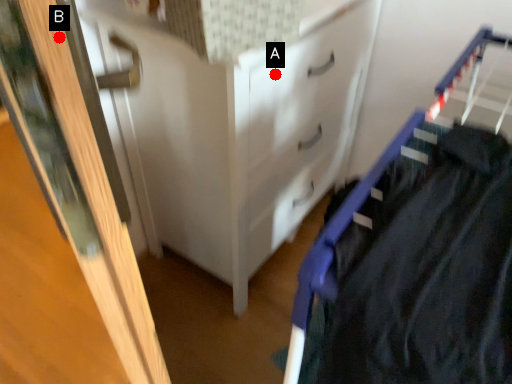
Question: Two points are circled on the image, labeled by A and B beside each circle. Which point appears closest to the camera in this image?

Choices:
 (A) A is closer
 (B) B is closer

Answer: (B)